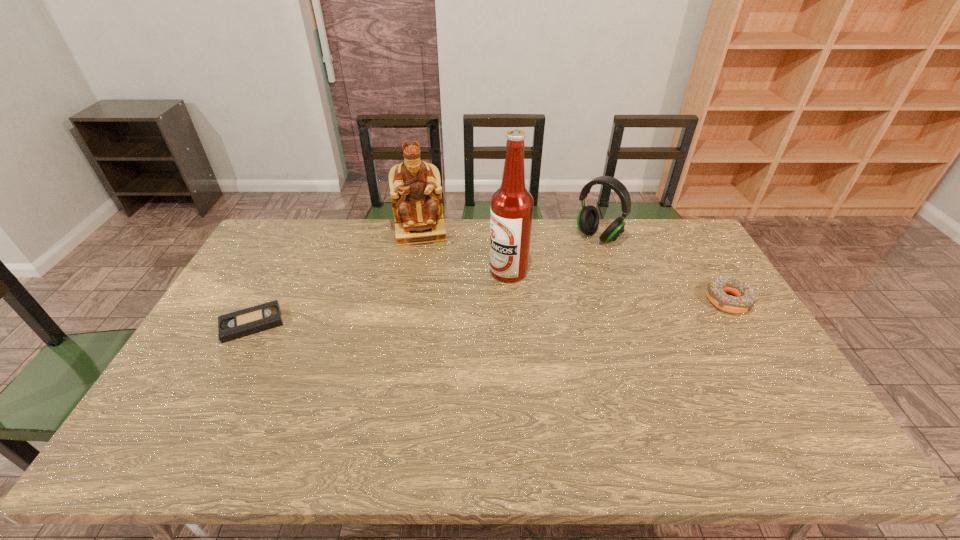
At what (x,y) coordinates should I click in order to perform the action: click on free space located on the front-facing side of the second object from left to right. Please return your answer as a coordinate pair (x, y). Looking at the image, I should click on (426, 286).

Image resolution: width=960 pixels, height=540 pixels. Identify the location of headset that is at the far edge. (588, 217).

The height and width of the screenshot is (540, 960). I want to click on figurine situated at the far edge, so click(x=415, y=186).

At what (x,y) coordinates should I click in order to perform the action: click on object present at the left edge. Please return your answer as a coordinate pair (x, y). Looking at the image, I should click on (242, 323).

Where is `object that is at the right edge`? The width and height of the screenshot is (960, 540). object that is at the right edge is located at coordinates (745, 298).

Where is `vacant space at the far edge of the desktop`? The image size is (960, 540). vacant space at the far edge of the desktop is located at coordinates (565, 249).

Image resolution: width=960 pixels, height=540 pixels. In the image, there is a desktop. In order to click on vacant space at the near edge in this screenshot , I will do `click(722, 399)`.

This screenshot has height=540, width=960. In the image, there is a desktop. Identify the location of vacant space at the right edge. (692, 262).

The width and height of the screenshot is (960, 540). In the image, there is a desktop. Identify the location of vacant region at the near left corner. (190, 402).

Identify the location of vacant space at the far right corner of the desktop. Image resolution: width=960 pixels, height=540 pixels. (699, 249).